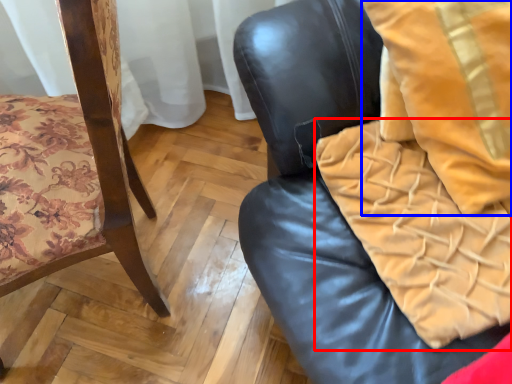
Question: Among these objects, which one is farthest to the camera, blanket (highlighted by a red box) or throw pillow (highlighted by a blue box)?

Choices:
 (A) blanket
 (B) throw pillow

Answer: (A)